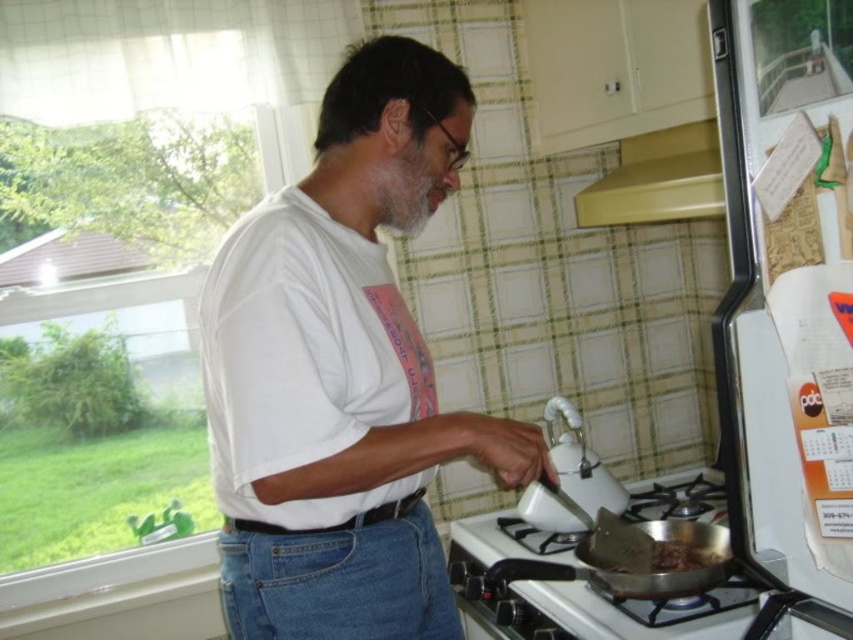
You are a chef standing at the stove in the kitchen. You need to place a new pot on the stove. The stove has four burners. The front burner is already occupied by the silver metallic frying pan at lower right. Which burner can you use to place the new pot?

Since the front burner is occupied by the silver metallic frying pan at lower right, you can use any of the other three burners on the stove to place the new pot.

You are a drone operator trying to capture a closeup of the yellow matte exhaust hood at upper center. The drone is currently positioned 5 feet away from the hood. Based on the scene description, can the drone move closer to get a better shot without hitting the hood?

The distance between the yellow matte exhaust hood at upper center and the camera is 4.63 feet. Since the drone is currently 5 feet away, it needs to move 0.37 feet closer to reach the camera position. However, moving closer than 4.63 feet would bring the drone too close and risk collision. Therefore, the drone cannot move closer than the current camera position without hitting the hood.

You are trying to decide whether to place the white glossy kettle at upper center into the silver metallic frying pan at lower right. Based on their sizes, is this possible?

The silver metallic frying pan at lower right might be wider than white glossy kettle at upper center, so it is possible to place the white glossy kettle at upper center into the silver metallic frying pan at lower right if the frying pan is indeed wider.